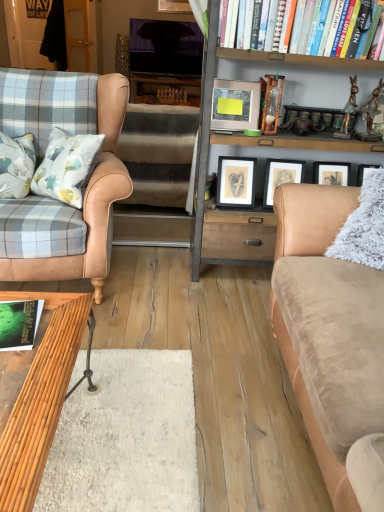
Image resolution: width=384 pixels, height=512 pixels. What do you see at coordinates (299, 53) in the screenshot?
I see `hardcover book at upper right, which is the second book from bottom to top` at bounding box center [299, 53].

Describe the element at coordinates (40, 406) in the screenshot. The width and height of the screenshot is (384, 512). I see `bamboo wood coffee table at lower left` at that location.

This screenshot has height=512, width=384. Describe the element at coordinates (334, 332) in the screenshot. I see `tan suede studio couch at right` at that location.

What is the approximate height of tan suede studio couch at right?

36.63 inches.

Image resolution: width=384 pixels, height=512 pixels. In order to click on tan leather chair at left in this screenshot , I will do `click(87, 187)`.

Measure the distance between brown plush stair at center and camera.

brown plush stair at center is 9.44 feet from camera.

Measure the distance between point (8, 301) and camera.

The depth of point (8, 301) is 1.30 meters.

The height and width of the screenshot is (512, 384). I want to click on matte silver picture frame at center, the 1th picture frame positioned from the right, so click(x=235, y=105).

Find the location of a particular element. This screenshot has height=512, width=384. hardcover book at upper right, placed as the first book when sorted from top to bottom is located at coordinates (299, 53).

Where is `the 2nd picture frame to the left of the hardcover book at upper right, placed as the first book when sorted from top to bottom, counting from the anchor's position`? This screenshot has width=384, height=512. the 2nd picture frame to the left of the hardcover book at upper right, placed as the first book when sorted from top to bottom, counting from the anchor's position is located at coordinates (174, 6).

Looking at this image, would you say hardcover book at upper right, the 1th book in the back-to-front sequence, is outside matte silver picture frame at upper center, the 1th picture frame positioned from the back?

Yes, hardcover book at upper right, the 1th book in the back-to-front sequence, is outside of matte silver picture frame at upper center, the 1th picture frame positioned from the back.

Is hardcover book at upper right, marked as the second book in a front-to-back arrangement, oriented away from matte silver picture frame at upper center, the 1th picture frame positioned from the back?

Yes, hardcover book at upper right, marked as the second book in a front-to-back arrangement,'s orientation is away from matte silver picture frame at upper center, the 1th picture frame positioned from the back.

What's the angular difference between hardcover book at upper right, the 1th book viewed from the right, and matte silver picture frame at upper center, the second picture frame ordered from the bottom,'s facing directions?

They differ by 0.402 degrees in their facing directions.

Is tan leather chair at left positioned beyond the bounds of bamboo wood coffee table at lower left?

Yes, tan leather chair at left is located beyond the bounds of bamboo wood coffee table at lower left.

Is tan leather chair at left at the right side of bamboo wood coffee table at lower left?

In fact, tan leather chair at left is to the left of bamboo wood coffee table at lower left.

Is point (107, 268) positioned before point (60, 367)?

No, it is not.

Could you tell me if tan leather chair at left is facing bamboo wood coffee table at lower left?

Yes, tan leather chair at left faces towards bamboo wood coffee table at lower left.

Looking at their sizes, would you say matte silver picture frame at upper center, which is the second picture frame from right to left, is wider or thinner than hardcover book at upper right, which is the second book from bottom to top?

matte silver picture frame at upper center, which is the second picture frame from right to left, is thinner than hardcover book at upper right, which is the second book from bottom to top.

Is matte silver picture frame at upper center, the 1th picture frame positioned from the back, smaller than hardcover book at upper right, placed as the first book when sorted from top to bottom?

Yes, matte silver picture frame at upper center, the 1th picture frame positioned from the back, is smaller than hardcover book at upper right, placed as the first book when sorted from top to bottom.

Consider the image. Which object is further away from the camera taking this photo, matte silver picture frame at upper center, which is the second picture frame from right to left, or hardcover book at upper right, the 1th book viewed from the right?

Positioned behind is matte silver picture frame at upper center, which is the second picture frame from right to left.

Which of these two, matte silver picture frame at upper center, the first picture frame viewed from the top, or hardcover book at upper right, placed as the first book when sorted from top to bottom, stands taller?

hardcover book at upper right, placed as the first book when sorted from top to bottom, is taller.

Does point (137, 220) lie behind point (25, 268)?

Yes, point (137, 220) is behind point (25, 268).

Looking at this image, is brown plush stair at center spatially inside tan leather chair at left, or outside of it?

brown plush stair at center exists outside the volume of tan leather chair at left.

Can you tell me how much brown plush stair at center and tan leather chair at left differ in facing direction?

They differ by 177 degrees in their facing directions.

Can you confirm if green matte book at lower left, which appears as the second book when viewed from the back, is thinner than brown plush stair at center?

Yes, green matte book at lower left, which appears as the second book when viewed from the back, is thinner than brown plush stair at center.

Is green matte book at lower left, marked as the second book in a top-to-bottom arrangement, smaller than brown plush stair at center?

Yes, green matte book at lower left, marked as the second book in a top-to-bottom arrangement, is smaller than brown plush stair at center.

From the image's perspective, is green matte book at lower left, the 1th book positioned from the bottom, on brown plush stair at center?

No.

Locate an element on the screen. book lying below the brown plush stair at center (from the image's perspective) is located at coordinates (19, 324).

Do you think hardcover book at upper right, the 1th book viewed from the right, is within tan leather chair at left, or outside of it?

hardcover book at upper right, the 1th book viewed from the right, lies outside tan leather chair at left.

Considering the positions of objects hardcover book at upper right, the 1th book viewed from the right, and tan leather chair at left in the image provided, who is behind, hardcover book at upper right, the 1th book viewed from the right, or tan leather chair at left?

hardcover book at upper right, the 1th book viewed from the right, is more distant.

Which is more distant, (336, 63) or (103, 149)?

The point (336, 63) is behind.

Considering the relative sizes of hardcover book at upper right, acting as the 2th book starting from the left, and tan leather chair at left in the image provided, is hardcover book at upper right, acting as the 2th book starting from the left, thinner than tan leather chair at left?

Correct, the width of hardcover book at upper right, acting as the 2th book starting from the left, is less than that of tan leather chair at left.

Is bamboo wood coffee table at lower left oriented away from matte silver picture frame at upper center, which is the second picture frame from right to left?

No, bamboo wood coffee table at lower left's orientation is not away from matte silver picture frame at upper center, which is the second picture frame from right to left.

Which object is closer to the camera taking this photo, bamboo wood coffee table at lower left or matte silver picture frame at upper center, the second picture frame ordered from the bottom?

bamboo wood coffee table at lower left is in front.

Considering the sizes of objects bamboo wood coffee table at lower left and matte silver picture frame at upper center, arranged as the 2th picture frame when viewed from the front, in the image provided, who is thinner, bamboo wood coffee table at lower left or matte silver picture frame at upper center, arranged as the 2th picture frame when viewed from the front,?

matte silver picture frame at upper center, arranged as the 2th picture frame when viewed from the front, is thinner.

Does bamboo wood coffee table at lower left touch matte silver picture frame at upper center, which is the second picture frame from right to left?

No, bamboo wood coffee table at lower left is not making contact with matte silver picture frame at upper center, which is the second picture frame from right to left.

Find the location of a particular element. The height and width of the screenshot is (512, 384). book lying on the right of matte silver picture frame at upper center, arranged as the 2th picture frame when viewed from the front is located at coordinates (299, 53).

The height and width of the screenshot is (512, 384). Identify the location of coffee table that is under the tan leather chair at left (from a real-world perspective). (40, 406).

Considering their positions, is satin wood bookcase at center positioned further to tan suede studio couch at right than brown plush stair at center?

Based on the image, brown plush stair at center appears to be further to tan suede studio couch at right.

When comparing their distances from tan leather chair at left, does brown plush stair at center or hardcover book at upper right, the 1th book viewed from the right, seem closer?

Among the two, brown plush stair at center is located nearer to tan leather chair at left.

Which object lies nearer to the anchor point matte silver picture frame at upper center, the first picture frame viewed from the top, hardcover book at upper right, acting as the 2th book starting from the left, or green matte book at lower left, positioned as the first book in front-to-back order?

hardcover book at upper right, acting as the 2th book starting from the left, is positioned closer to the anchor matte silver picture frame at upper center, the first picture frame viewed from the top.

Looking at the image, which one is located closer to matte silver picture frame at center, acting as the 2th picture frame starting from the back, matte silver picture frame at upper center, the second picture frame ordered from the bottom, or tan suede studio couch at right?

tan suede studio couch at right.

Which object lies further to the anchor point brown plush stair at center, bamboo wood coffee table at lower left or satin wood bookcase at center?

Among the two, bamboo wood coffee table at lower left is located further to brown plush stair at center.

Which object lies further to the anchor point matte silver picture frame at upper center, the second picture frame ordered from the bottom, matte silver picture frame at center, positioned as the 2th picture frame in left-to-right order, or bamboo wood coffee table at lower left?

Based on the image, bamboo wood coffee table at lower left appears to be further to matte silver picture frame at upper center, the second picture frame ordered from the bottom.

Which object lies further to the anchor point matte silver picture frame at upper center, arranged as the 2th picture frame when viewed from the front, tan leather chair at left or bamboo wood coffee table at lower left?

Based on the image, bamboo wood coffee table at lower left appears to be further to matte silver picture frame at upper center, arranged as the 2th picture frame when viewed from the front.

When comparing their distances from matte silver picture frame at upper center, positioned as the first picture frame in left-to-right order, does tan leather chair at left or tan suede studio couch at right seem closer?

The object closer to matte silver picture frame at upper center, positioned as the first picture frame in left-to-right order, is tan leather chair at left.

The height and width of the screenshot is (512, 384). I want to click on picture frame between hardcover book at upper right, which is the second book from bottom to top, and brown plush stair at center, along the z-axis, so click(x=235, y=105).

The width and height of the screenshot is (384, 512). In order to click on stair located between hardcover book at upper right, the 1th book in the back-to-front sequence, and matte silver picture frame at upper center, the 1th picture frame positioned from the back, in the depth direction in this screenshot , I will do `click(157, 176)`.

At what (x,y) coordinates should I click in order to perform the action: click on picture frame between hardcover book at upper right, the 1th book in the back-to-front sequence, and green matte book at lower left, which appears as the second book when viewed from the back, from top to bottom. Please return your answer as a coordinate pair (x, y). The image size is (384, 512). Looking at the image, I should click on (235, 105).

This screenshot has height=512, width=384. I want to click on picture frame between bamboo wood coffee table at lower left and matte silver picture frame at upper center, the first picture frame viewed from the top, in the front-back direction, so click(x=235, y=105).